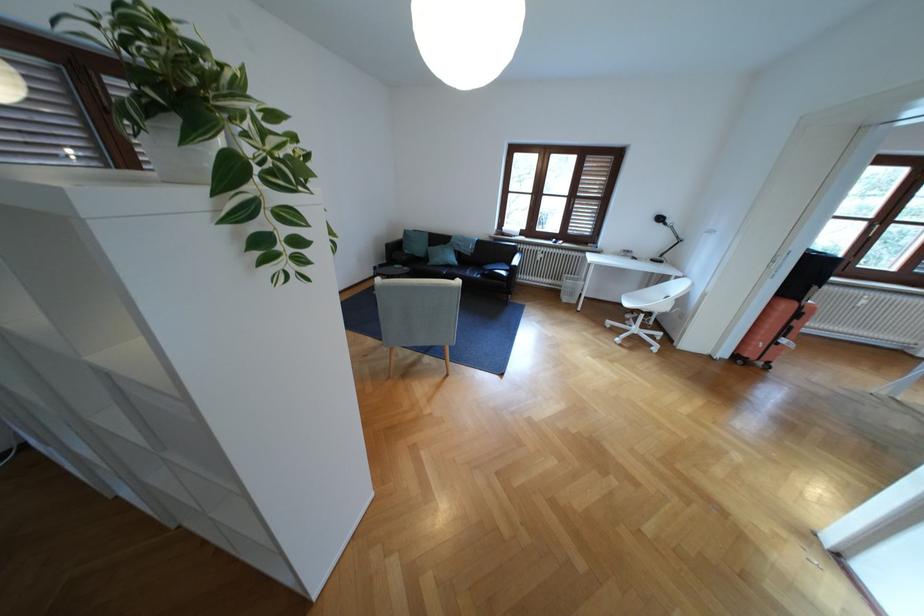
Which object does [773,331] point to?

It corresponds to the orange suitcase in the image.